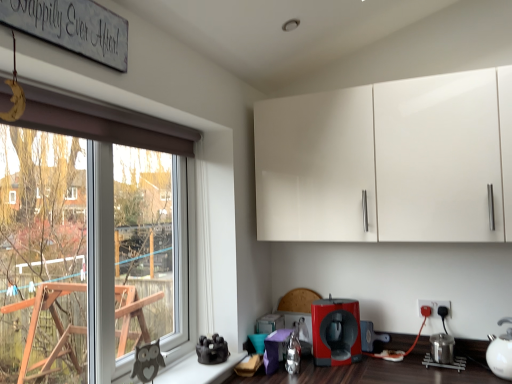
Question: Is wooden signboard at upper left far away from matte black electric outlet at lower right?

Choices:
 (A) yes
 (B) no

Answer: (A)

Question: Is wooden signboard at upper left smaller than matte black electric outlet at lower right?

Choices:
 (A) no
 (B) yes

Answer: (A)

Question: Is wooden signboard at upper left in front of matte black electric outlet at lower right?

Choices:
 (A) no
 (B) yes

Answer: (B)

Question: Could you tell me if wooden signboard at upper left is facing matte black electric outlet at lower right?

Choices:
 (A) no
 (B) yes

Answer: (A)

Question: Can you confirm if wooden signboard at upper left is taller than matte black electric outlet at lower right?

Choices:
 (A) no
 (B) yes

Answer: (B)

Question: Is white glossy cabinet at upper center situated inside white glossy tea pot at lower right or outside?

Choices:
 (A) outside
 (B) inside

Answer: (A)

Question: Considering their positions, is white glossy cabinet at upper center located in front of or behind white glossy tea pot at lower right?

Choices:
 (A) front
 (B) behind

Answer: (A)

Question: Considering the positions of white glossy cabinet at upper center and white glossy tea pot at lower right in the image, is white glossy cabinet at upper center bigger or smaller than white glossy tea pot at lower right?

Choices:
 (A) small
 (B) big

Answer: (B)

Question: From a real-world perspective, is white glossy cabinet at upper center above or below white glossy tea pot at lower right?

Choices:
 (A) below
 (B) above

Answer: (B)

Question: In the image, is white glossy tea pot at lower right positioned in front of or behind wooden signboard at upper left?

Choices:
 (A) behind
 (B) front

Answer: (A)

Question: Considering the positions of white glossy tea pot at lower right and wooden signboard at upper left in the image, is white glossy tea pot at lower right wider or thinner than wooden signboard at upper left?

Choices:
 (A) wide
 (B) thin

Answer: (A)

Question: Looking at the image, does white glossy tea pot at lower right seem bigger or smaller compared to wooden signboard at upper left?

Choices:
 (A) small
 (B) big

Answer: (B)

Question: From the image's perspective, relative to wooden signboard at upper left, is white glossy tea pot at lower right above or below?

Choices:
 (A) below
 (B) above

Answer: (A)

Question: In terms of height, does matte black electric outlet at lower right look taller or shorter compared to white glossy tea pot at lower right?

Choices:
 (A) short
 (B) tall

Answer: (A)

Question: From the image's perspective, relative to white glossy tea pot at lower right, is matte black electric outlet at lower right above or below?

Choices:
 (A) below
 (B) above

Answer: (B)